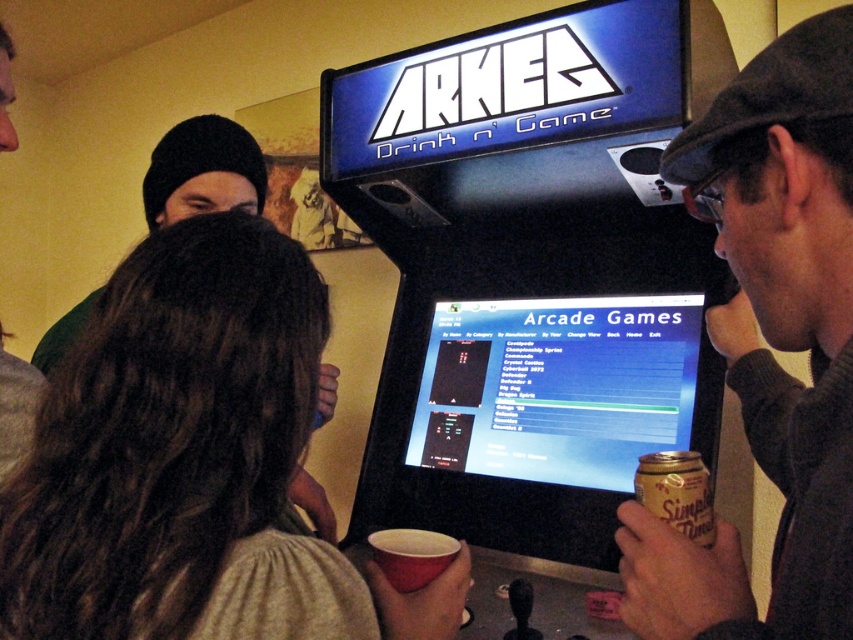
You are at an arcade and see the dark gray wool cap at upper right and the matte red cup at lower center. Which object is nearer to you?

The dark gray wool cap at upper right is closer to the viewer than the matte red cup at lower center.

You are at an arcade and want to grab the gold foil can at lower right without touching the dark gray wool cap at upper right. Is there enough space between them?

The dark gray wool cap at upper right is located above the gold foil can at lower right, so there is vertical space between them. You can reach the gold foil can at lower right without touching the cap.

From the picture: What are the coordinates of the dark gray wool cap at upper right?

The dark gray wool cap at upper right is located at coordinates point (x=770, y=344).